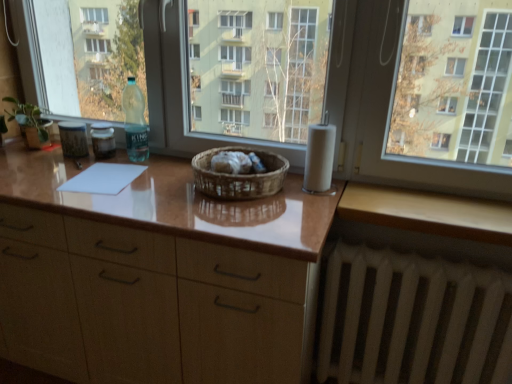
Find the location of `unoccupied area in front of translucent plastic bottle at left`. unoccupied area in front of translucent plastic bottle at left is located at coordinates (91, 169).